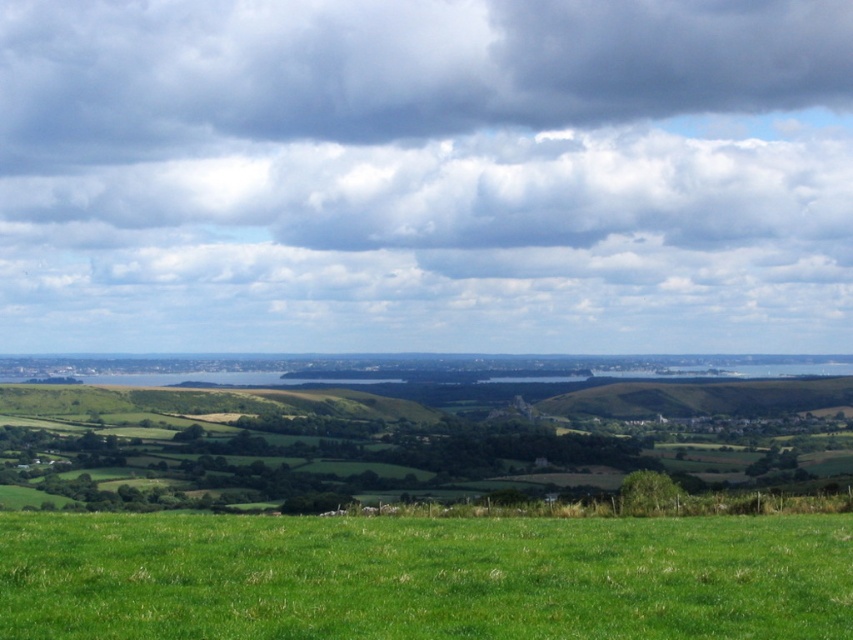
How far apart are dark gray cloud at upper center and green grassy field at lower center?

dark gray cloud at upper center and green grassy field at lower center are 439.37 meters apart from each other.

Which is more to the right, dark gray cloud at upper center or green grassy field at lower center?

From the viewer's perspective, green grassy field at lower center appears more on the right side.

What do you see at coordinates (392, 68) in the screenshot? This screenshot has height=640, width=853. I see `dark gray cloud at upper center` at bounding box center [392, 68].

The width and height of the screenshot is (853, 640). Identify the location of dark gray cloud at upper center. (392, 68).

Is cloudy sky at upper center to the left of dark gray cloud at upper center from the viewer's perspective?

In fact, cloudy sky at upper center is to the right of dark gray cloud at upper center.

Is cloudy sky at upper center wider than dark gray cloud at upper center?

Correct, the width of cloudy sky at upper center exceeds that of dark gray cloud at upper center.

This screenshot has height=640, width=853. I want to click on cloudy sky at upper center, so click(x=425, y=177).

Is cloudy sky at upper center positioned before green grassy field at lower center?

That is False.

The height and width of the screenshot is (640, 853). Describe the element at coordinates (425, 177) in the screenshot. I see `cloudy sky at upper center` at that location.

Identify the location of cloudy sky at upper center. (425, 177).